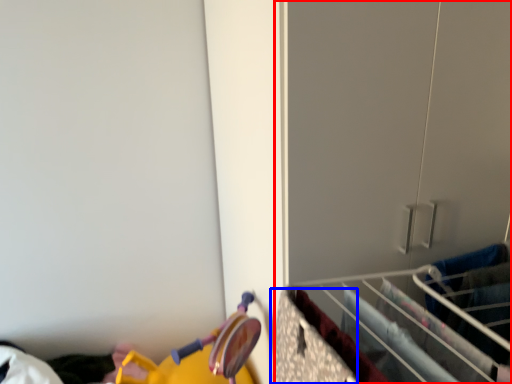
Question: Among these objects, which one is nearest to the camera, closet (highlighted by a red box) or drawer (highlighted by a blue box)?

Choices:
 (A) closet
 (B) drawer

Answer: (B)